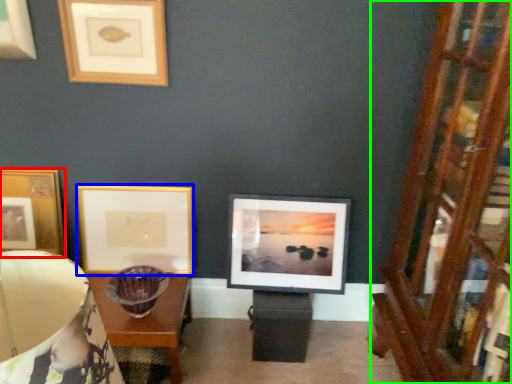
Question: Which object is positioned farthest from picture frame (highlighted by a red box)? Select from picture frame (highlighted by a blue box) and dresser (highlighted by a green box).

Choices:
 (A) picture frame
 (B) dresser

Answer: (B)